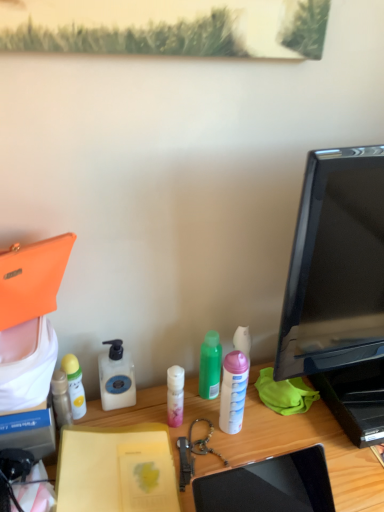
What do you see at coordinates (335, 265) in the screenshot?
I see `black glossy monitor at right` at bounding box center [335, 265].

The width and height of the screenshot is (384, 512). I want to click on white matte bottle at center, marked as the third bottle in a left-to-right arrangement, so click(116, 377).

Image resolution: width=384 pixels, height=512 pixels. What do you see at coordinates (75, 385) in the screenshot? I see `yellow matte bottle at left, arranged as the second bottle when viewed from the left` at bounding box center [75, 385].

Describe the element at coordinates (116, 469) in the screenshot. This screenshot has width=384, height=512. I see `yellow matte notebook at center` at that location.

Identify the location of wooden desk at center. The image size is (384, 512). (290, 443).

This screenshot has width=384, height=512. I want to click on black glossy monitor at right, so click(x=335, y=265).

Between white matte spray can at center, arranged as the 5th bottle when viewed from the left, and green matte bottle at center, which is the 2th bottle in right-to-left order, which one has less height?

green matte bottle at center, which is the 2th bottle in right-to-left order.

Is green matte bottle at center, placed as the fourth bottle when sorted from left to right, located within white matte spray can at center, the 1th bottle from the right?

No, green matte bottle at center, placed as the fourth bottle when sorted from left to right, is not inside white matte spray can at center, the 1th bottle from the right.

Does white matte spray can at center, the 1th bottle from the right, turn towards green matte bottle at center, placed as the fourth bottle when sorted from left to right?

No, white matte spray can at center, the 1th bottle from the right, is not aimed at green matte bottle at center, placed as the fourth bottle when sorted from left to right.

Between white matte spray can at center, the 1th bottle from the right, and green matte bottle at center, which is the 2th bottle in right-to-left order, which one has smaller width?

With smaller width is green matte bottle at center, which is the 2th bottle in right-to-left order.

Which is less distant, (x=72, y=385) or (x=290, y=360)?

The point (x=290, y=360) is closer.

Is yellow matte bottle at left, acting as the 4th bottle starting from the right, surrounding black glossy monitor at right?

Actually, black glossy monitor at right is outside yellow matte bottle at left, acting as the 4th bottle starting from the right.

Find the location of a particular element. This screenshot has height=512, width=384. television located on the right of yellow matte bottle at left, acting as the 4th bottle starting from the right is located at coordinates (335, 265).

In the scene shown: Is yellow matte bottle at left, acting as the 4th bottle starting from the right, inside or outside of green matte bottle at center, placed as the fourth bottle when sorted from left to right?

yellow matte bottle at left, acting as the 4th bottle starting from the right, cannot be found inside green matte bottle at center, placed as the fourth bottle when sorted from left to right.

Is point (72, 364) behind point (205, 364)?

No, (72, 364) is in front of (205, 364).

Consider the image. From a real-world perspective, which is physically below, yellow matte bottle at left, acting as the 4th bottle starting from the right, or green matte bottle at center, placed as the fourth bottle when sorted from left to right?

From a 3D spatial view, yellow matte bottle at left, acting as the 4th bottle starting from the right, is below.

Considering the sizes of objects yellow matte bottle at left, acting as the 4th bottle starting from the right, and green matte bottle at center, placed as the fourth bottle when sorted from left to right, in the image provided, who is thinner, yellow matte bottle at left, acting as the 4th bottle starting from the right, or green matte bottle at center, placed as the fourth bottle when sorted from left to right,?

With smaller width is yellow matte bottle at left, acting as the 4th bottle starting from the right.

From a real-world perspective, between white matte bottle at center, the third bottle viewed from the right, and green matte bottle at center, which is the 2th bottle in right-to-left order, who is vertically lower?

From a 3D spatial view, white matte bottle at center, the third bottle viewed from the right, is below.

Consider the image. Between white matte bottle at center, the third bottle viewed from the right, and green matte bottle at center, which is the 2th bottle in right-to-left order, which one has less height?

white matte bottle at center, the third bottle viewed from the right, is shorter.

Is white matte bottle at center, marked as the third bottle in a left-to-right arrangement, turned away from green matte bottle at center, which is the 2th bottle in right-to-left order?

No, green matte bottle at center, which is the 2th bottle in right-to-left order, is not at the back of white matte bottle at center, marked as the third bottle in a left-to-right arrangement.

Considering their positions, is white matte bottle at center, the third bottle viewed from the right, located in front of or behind translucent plastic bottle at left, the 1th bottle when ordered from left to right?

white matte bottle at center, the third bottle viewed from the right, is behind translucent plastic bottle at left, the 1th bottle when ordered from left to right.

Considering the positions of point (123, 351) and point (57, 375), is point (123, 351) closer or farther from the camera than point (57, 375)?

Point (123, 351) is positioned farther from the camera compared to point (57, 375).

How many degrees apart are the facing directions of white matte bottle at center, marked as the third bottle in a left-to-right arrangement, and translucent plastic bottle at left, the 1th bottle when ordered from left to right?

The angular difference between white matte bottle at center, marked as the third bottle in a left-to-right arrangement, and translucent plastic bottle at left, the 1th bottle when ordered from left to right, is 0.00496 degrees.

Is translucent plastic bottle at left, the 1th bottle when ordered from left to right, located within white matte bottle at center, the third bottle viewed from the right?

Definitely not — translucent plastic bottle at left, the 1th bottle when ordered from left to right, is not inside white matte bottle at center, the third bottle viewed from the right.

From a real-world perspective, is white matte spray can at center, arranged as the 5th bottle when viewed from the left, physically below yellow matte bottle at left, arranged as the second bottle when viewed from the left?

Actually, white matte spray can at center, arranged as the 5th bottle when viewed from the left, is physically above yellow matte bottle at left, arranged as the second bottle when viewed from the left, in the real world.

Would you consider white matte spray can at center, arranged as the 5th bottle when viewed from the left, to be distant from yellow matte bottle at left, arranged as the second bottle when viewed from the left?

That's not correct — white matte spray can at center, arranged as the 5th bottle when viewed from the left, is a little close to yellow matte bottle at left, arranged as the second bottle when viewed from the left.

Is white matte spray can at center, arranged as the 5th bottle when viewed from the left, oriented towards yellow matte bottle at left, arranged as the second bottle when viewed from the left?

No, white matte spray can at center, arranged as the 5th bottle when viewed from the left, is not facing towards yellow matte bottle at left, arranged as the second bottle when viewed from the left.

From the image's perspective, which is below, white matte spray can at center, arranged as the 5th bottle when viewed from the left, or yellow matte bottle at left, arranged as the second bottle when viewed from the left?

yellow matte bottle at left, arranged as the second bottle when viewed from the left, from the image's perspective.

Is white matte spray can at center, arranged as the 5th bottle when viewed from the left, in front of or behind black glossy monitor at right in the image?

Visually, white matte spray can at center, arranged as the 5th bottle when viewed from the left, is located behind black glossy monitor at right.

From the image's perspective, is white matte spray can at center, the 1th bottle from the right, over black glossy monitor at right?

Incorrect, from the image's perspective, white matte spray can at center, the 1th bottle from the right, is lower than black glossy monitor at right.

Can you confirm if white matte spray can at center, the 1th bottle from the right, is bigger than black glossy monitor at right?

No.

What are the coordinates of `bottle on the right of green matte bottle at center, placed as the fourth bottle when sorted from left to right` in the screenshot? It's located at (233, 392).

The height and width of the screenshot is (512, 384). I want to click on television in front of the yellow matte bottle at left, arranged as the second bottle when viewed from the left, so click(x=335, y=265).

When comparing their distances from white matte bottle at center, marked as the third bottle in a left-to-right arrangement, does green matte bottle at center, which is the 2th bottle in right-to-left order, or yellow matte notebook at center seem closer?

Based on the image, yellow matte notebook at center appears to be nearer to white matte bottle at center, marked as the third bottle in a left-to-right arrangement.

Considering their positions, is wooden desk at center positioned closer to black glossy monitor at right than translucent plastic bottle at left, the 5th bottle when ordered from right to left?

wooden desk at center is positioned closer to the anchor black glossy monitor at right.

When comparing their distances from black glossy monitor at right, does white matte bottle at center, marked as the third bottle in a left-to-right arrangement, or yellow matte bottle at left, acting as the 4th bottle starting from the right, seem closer?

white matte bottle at center, marked as the third bottle in a left-to-right arrangement.

From the image, which object appears to be farther from wooden desk at center, white matte spray can at center, the 1th bottle from the right, or black glossy monitor at right?

black glossy monitor at right lies further to wooden desk at center than the other object.

Which object lies nearer to the anchor point yellow matte bottle at left, acting as the 4th bottle starting from the right, yellow matte notebook at center or white matte spray can at center, arranged as the 5th bottle when viewed from the left?

yellow matte notebook at center is closer to yellow matte bottle at left, acting as the 4th bottle starting from the right.

When comparing their distances from green matte bottle at center, which is the 2th bottle in right-to-left order, does white matte spray can at center, arranged as the 5th bottle when viewed from the left, or wooden desk at center seem closer?

Among the two, white matte spray can at center, arranged as the 5th bottle when viewed from the left, is located nearer to green matte bottle at center, which is the 2th bottle in right-to-left order.

Looking at the image, which one is located further to black glossy monitor at right, wooden desk at center or yellow matte notebook at center?

yellow matte notebook at center is further to black glossy monitor at right.

Based on their spatial positions, is wooden desk at center or black glossy monitor at right closer to white matte bottle at center, the third bottle viewed from the right?

Based on the image, wooden desk at center appears to be nearer to white matte bottle at center, the third bottle viewed from the right.

Identify the location of bottle located between yellow matte bottle at left, arranged as the second bottle when viewed from the left, and green matte bottle at center, placed as the fourth bottle when sorted from left to right, in the left-right direction. (116, 377).

Where is `notebook situated between yellow matte bottle at left, arranged as the second bottle when viewed from the left, and black glossy monitor at right from left to right`? The image size is (384, 512). notebook situated between yellow matte bottle at left, arranged as the second bottle when viewed from the left, and black glossy monitor at right from left to right is located at coordinates (116, 469).

You are a GUI agent. You are given a task and a screenshot of the screen. Output one action in this format:
    pyautogui.click(x=<x>, y=<y>)
    Task: Click on the notebook situated between translucent plastic bottle at left, the 1th bottle when ordered from left to right, and wooden desk at center from left to right
    This screenshot has width=384, height=512.
    Given the screenshot: What is the action you would take?
    pyautogui.click(x=116, y=469)

This screenshot has width=384, height=512. I want to click on bottle between white matte bottle at center, the third bottle viewed from the right, and white matte spray can at center, the 1th bottle from the right, from left to right, so click(x=210, y=366).